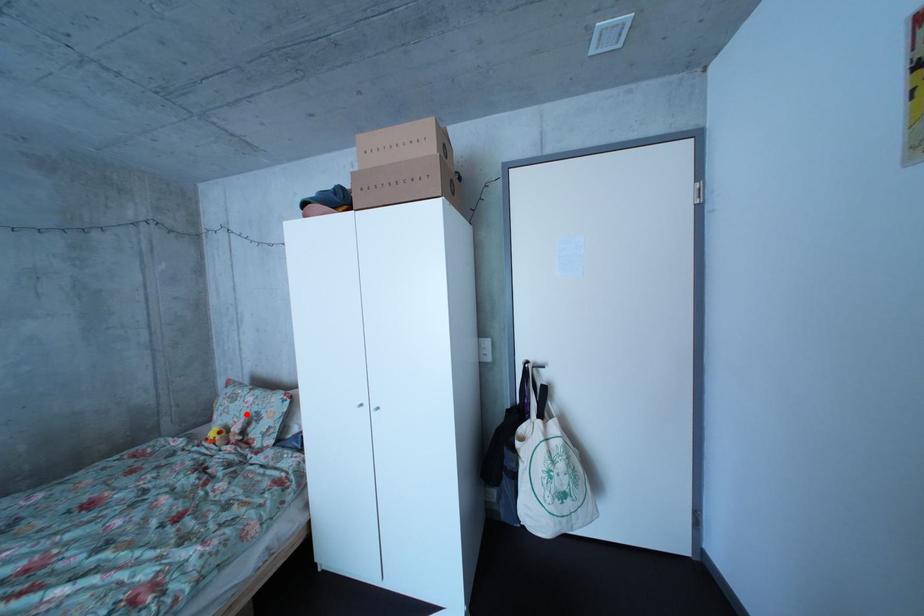
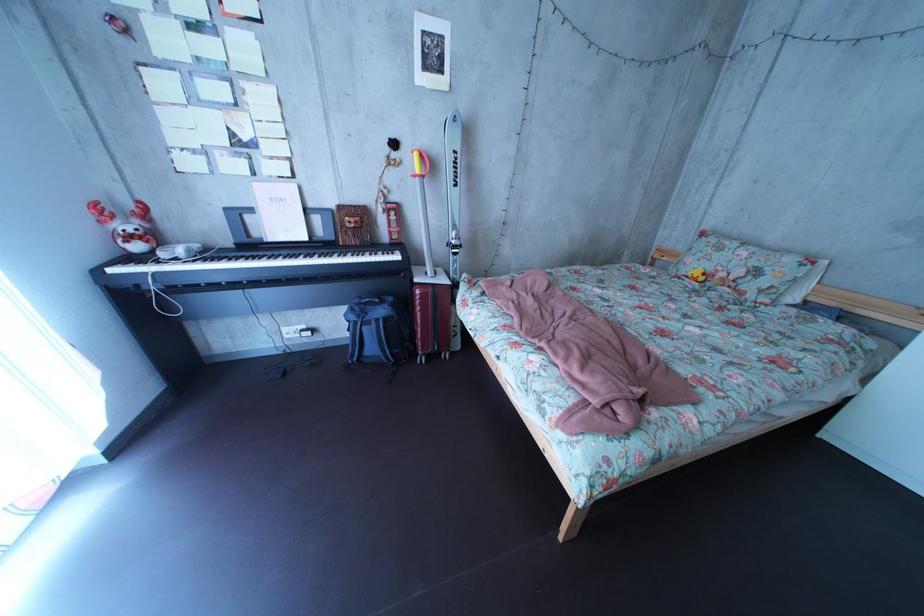
Where in the second image is the point corresponding to the highlighted location from the first image?

(731, 262)